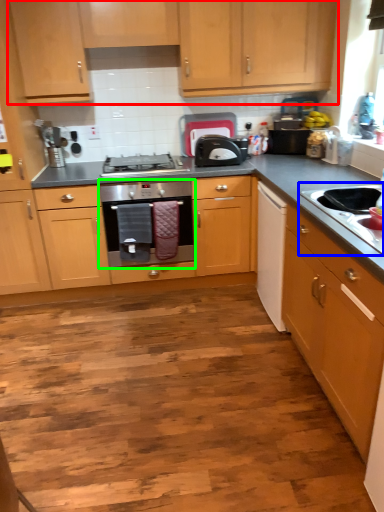
Question: Which object is the closest to the cabinetry (highlighted by a red box)? Choose among these: sink (highlighted by a blue box) or home appliance (highlighted by a green box).

Choices:
 (A) sink
 (B) home appliance

Answer: (B)